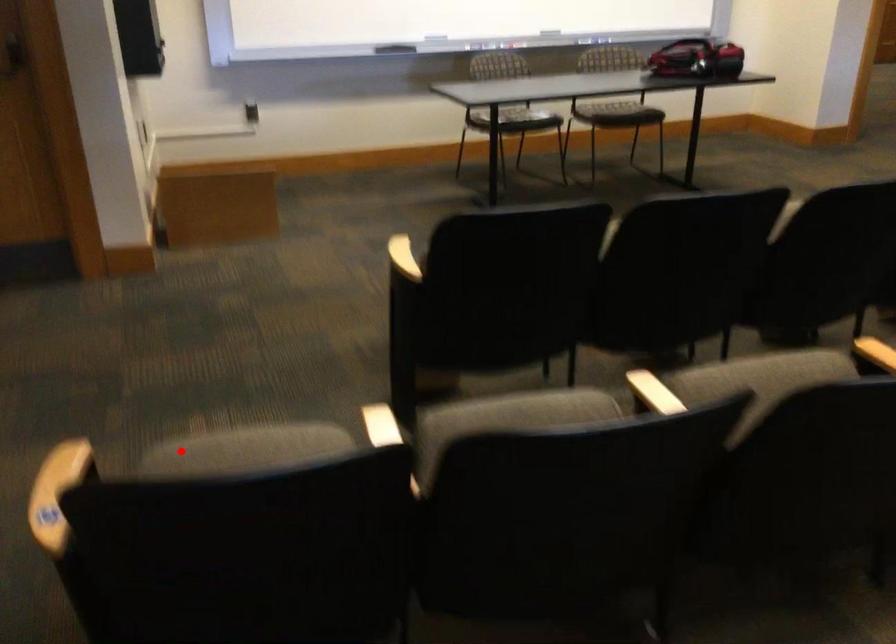
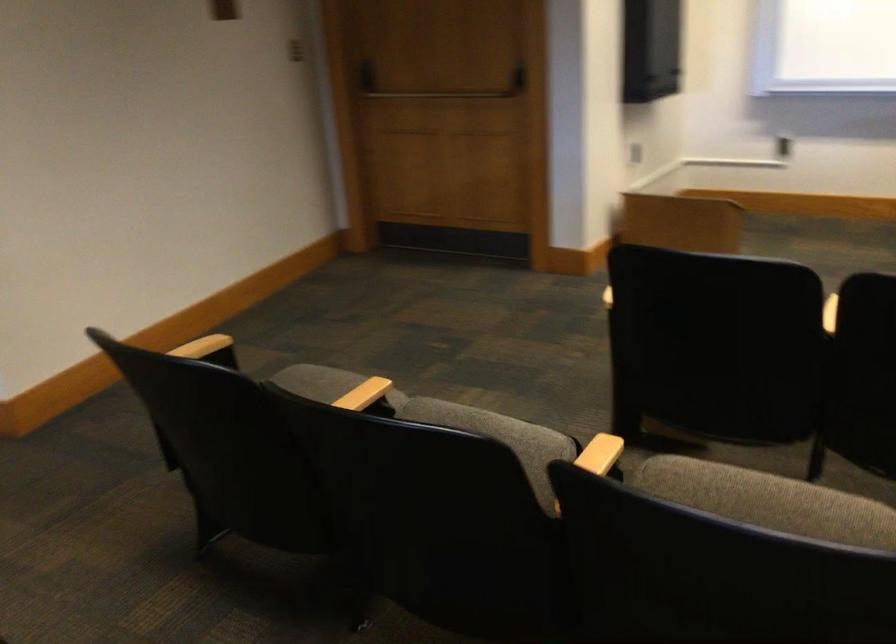
Where in the second image is the point corresponding to the highlighted location from the first image?

(304, 370)